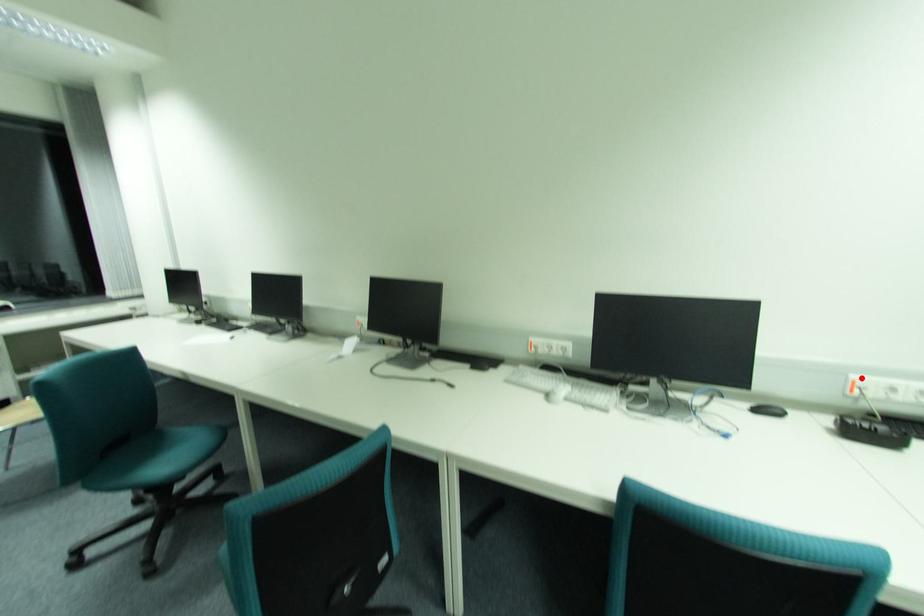
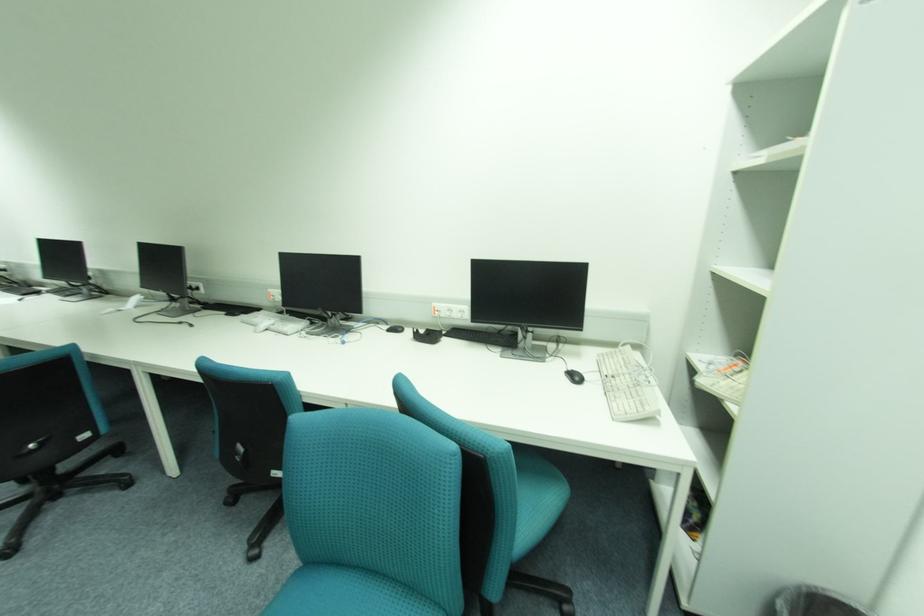
The point at the highlighted location is marked in the first image. Where is the corresponding point in the second image?

(441, 305)